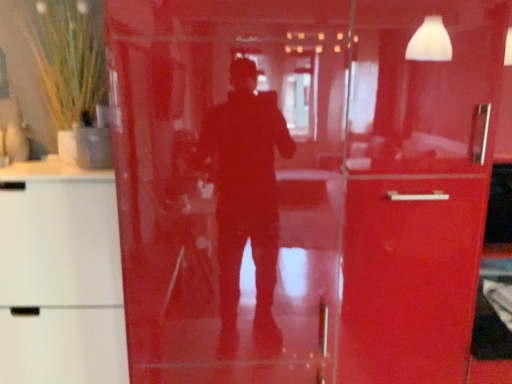
Question: From a real-world perspective, is white matte cabinet at left physically located above or below green grass-like plant in vase at upper left?

Choices:
 (A) below
 (B) above

Answer: (A)

Question: From their relative heights in the image, would you say white matte cabinet at left is taller or shorter than green grass-like plant in vase at upper left?

Choices:
 (A) tall
 (B) short

Answer: (A)

Question: Is point (109, 327) closer or farther from the camera than point (88, 16)?

Choices:
 (A) closer
 (B) farther

Answer: (A)

Question: From a real-world perspective, is green grass-like plant in vase at upper left positioned above or below white matte cabinet at left?

Choices:
 (A) below
 (B) above

Answer: (B)

Question: Relative to white matte cabinet at left, is green grass-like plant in vase at upper left in front or behind?

Choices:
 (A) front
 (B) behind

Answer: (B)

Question: From the image's perspective, relative to white matte cabinet at left, is green grass-like plant in vase at upper left above or below?

Choices:
 (A) below
 (B) above

Answer: (B)

Question: Which is correct: green grass-like plant in vase at upper left is inside white matte cabinet at left, or outside of it?

Choices:
 (A) inside
 (B) outside

Answer: (B)